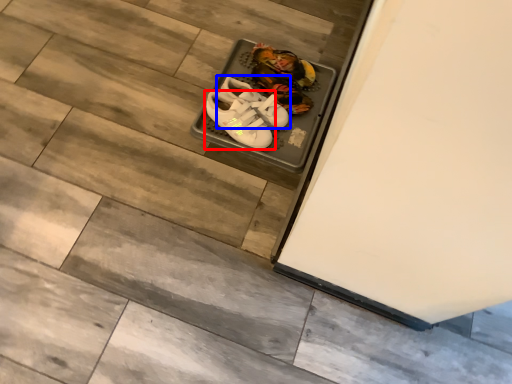
Question: Among these objects, which one is nearest to the camera, footwear (highlighted by a red box) or footwear (highlighted by a blue box)?

Choices:
 (A) footwear
 (B) footwear

Answer: (A)